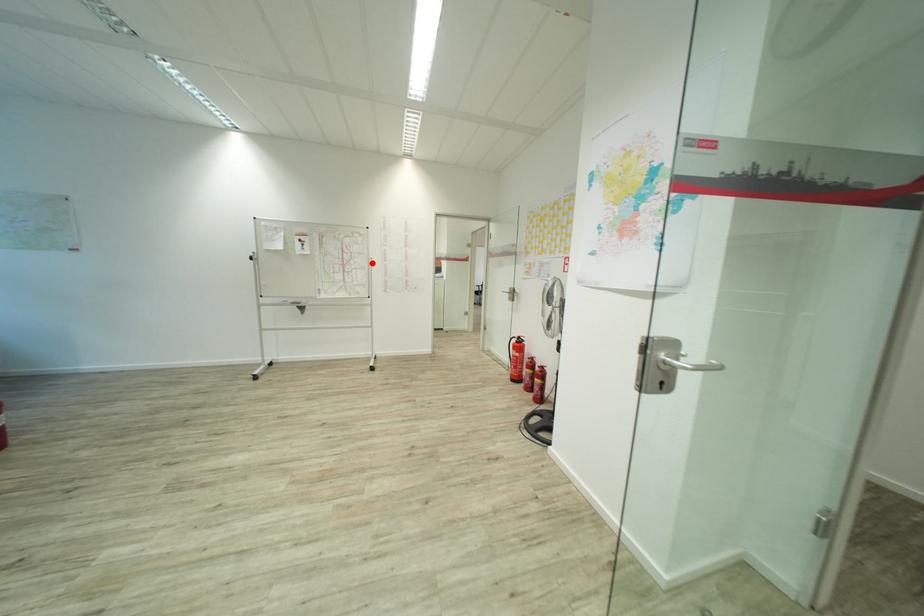
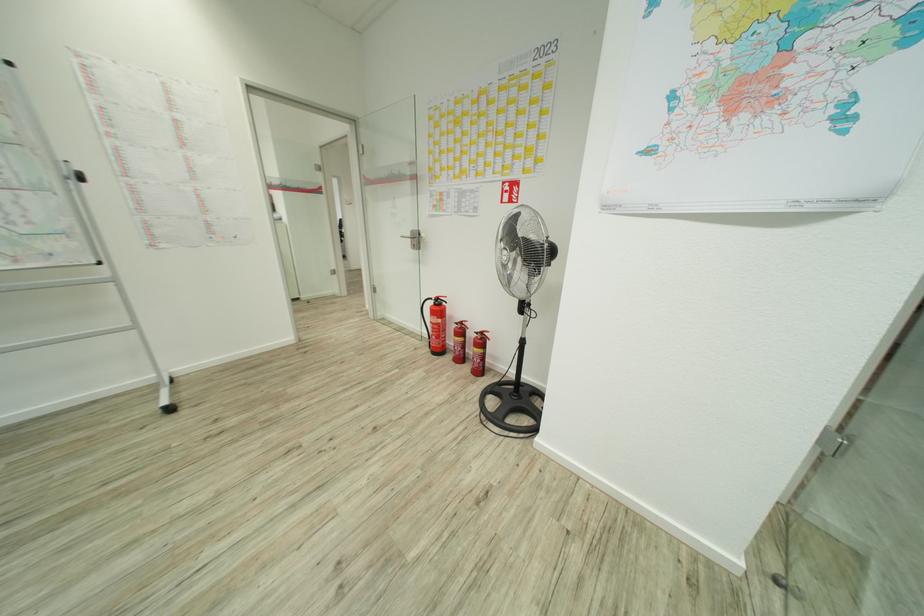
In the second image, find the point that corresponds to the highlighted location in the first image.

(80, 176)